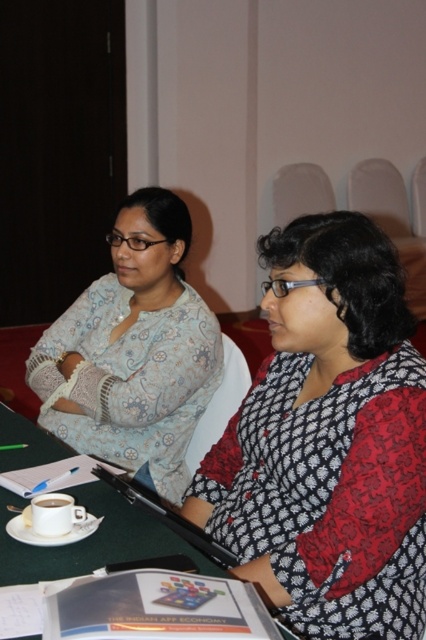
Who is lower down, patterned fabric blouse at center or matte white cup at lower left?

matte white cup at lower left

Does patterned fabric blouse at center have a greater width compared to matte white cup at lower left?

Yes.

Does point (154, 216) come farther from viewer compared to point (39, 528)?

Yes, it is.

The image size is (426, 640). I want to click on patterned fabric blouse at center, so click(x=134, y=349).

Is matte white cup at lower left below white ceramic cup at center?

Yes.

The width and height of the screenshot is (426, 640). What do you see at coordinates (54, 515) in the screenshot?
I see `matte white cup at lower left` at bounding box center [54, 515].

The height and width of the screenshot is (640, 426). Identify the location of matte white cup at lower left. (54, 515).

Which is above, green fabric table at center or matte white cup at lower left?

matte white cup at lower left is above.

The width and height of the screenshot is (426, 640). Identify the location of green fabric table at center. (92, 540).

Describe the element at coordinates (92, 540) in the screenshot. I see `green fabric table at center` at that location.

Where is `green fabric table at center`? This screenshot has width=426, height=640. green fabric table at center is located at coordinates (92, 540).